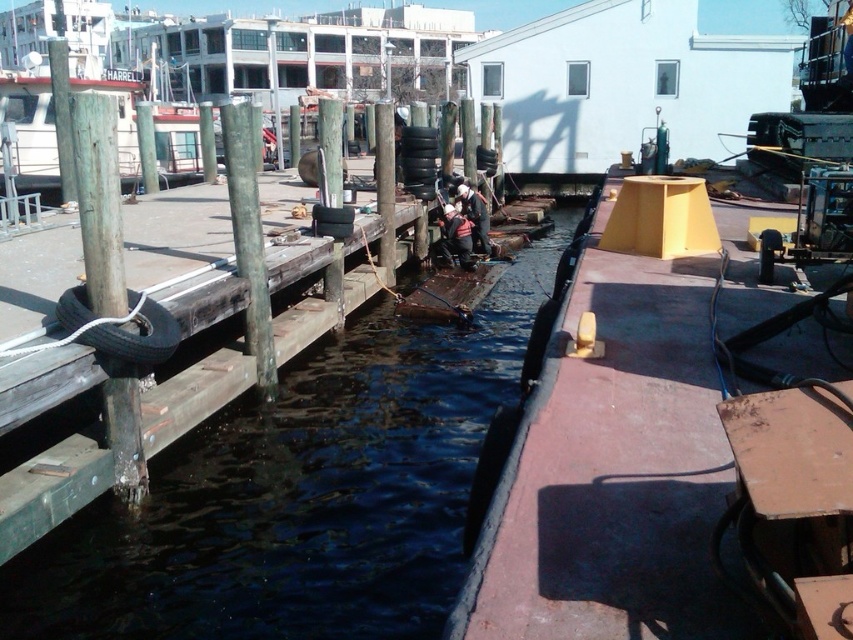
Which is below, smooth brown dock at center or white fabric jacket at center?

smooth brown dock at center is below.

Does smooth brown dock at center appear under white fabric jacket at center?

Correct, smooth brown dock at center is located below white fabric jacket at center.

Is point (668, 513) positioned in front of point (474, 205)?

Yes, point (668, 513) is in front of point (474, 205).

I want to click on smooth brown dock at center, so click(670, 448).

Can you confirm if smooth brown dock at center is wider than white glossy boat at upper left?

Incorrect, smooth brown dock at center's width does not surpass white glossy boat at upper left's.

Between smooth brown dock at center and white glossy boat at upper left, which one appears on the left side from the viewer's perspective?

white glossy boat at upper left

What are the coordinates of `smooth brown dock at center` in the screenshot? It's located at (670, 448).

Who is shorter, smooth brown dock at center or dark wood waterway at center?

With less height is smooth brown dock at center.

Is point (579, 620) positioned after point (318, 406)?

No, it is in front of (318, 406).

The image size is (853, 640). In order to click on smooth brown dock at center in this screenshot , I will do `click(670, 448)`.